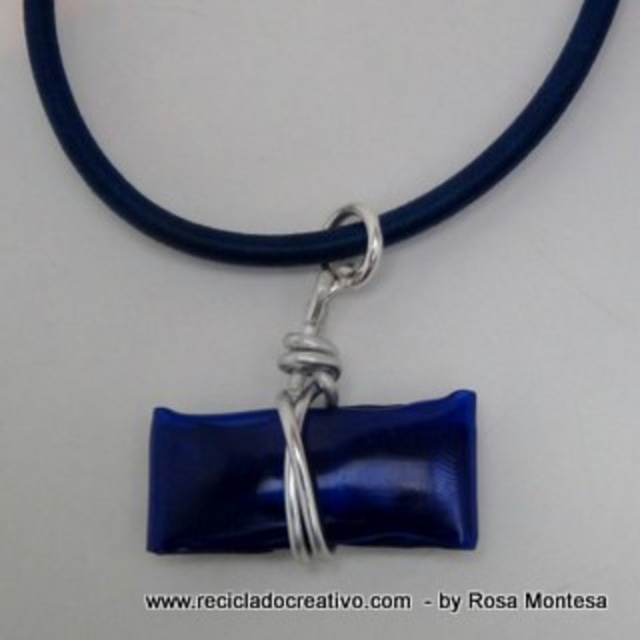
Is glossy blue glass at center taller than glossy blue glass pendant at center?

Incorrect, glossy blue glass at center's height is not larger of glossy blue glass pendant at center's.

You are a GUI agent. You are given a task and a screenshot of the screen. Output one action in this format:
    pyautogui.click(x=<x>, y=<y>)
    Task: Click on the glossy blue glass at center
    This screenshot has height=640, width=640.
    Given the screenshot: What is the action you would take?
    pyautogui.click(x=396, y=472)

At what (x,y) coordinates should I click in order to perform the action: click on glossy blue glass at center. Please return your answer as a coordinate pair (x, y). This screenshot has height=640, width=640. Looking at the image, I should click on (396, 472).

Find the location of a particular element. glossy blue glass at center is located at coordinates (396, 472).